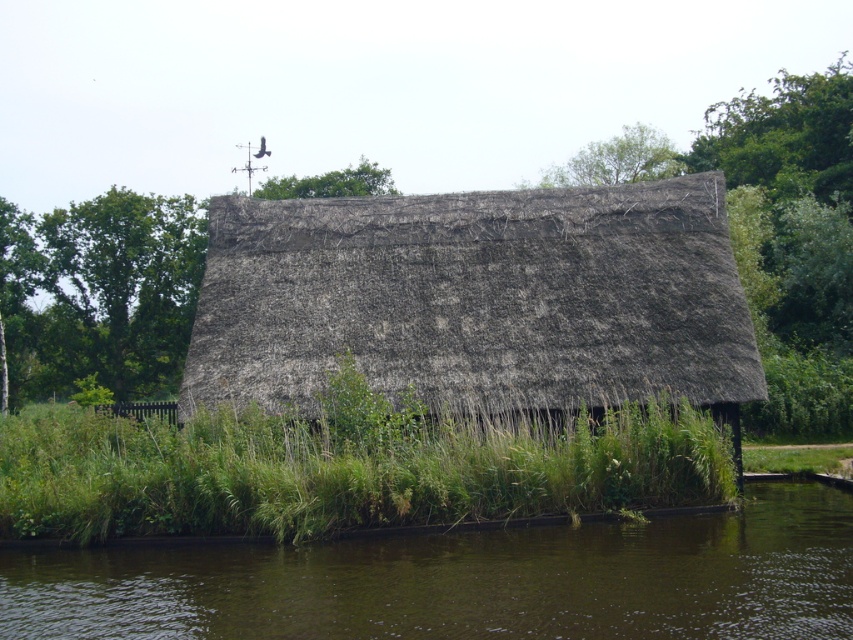
Question: Does brown murky water at lower center have a smaller size compared to green grass at lower center?

Choices:
 (A) yes
 (B) no

Answer: (A)

Question: Which point is farther to the camera?

Choices:
 (A) green grass at lower center
 (B) brown thatch roof at center

Answer: (B)

Question: In this image, where is brown thatch roof at center located relative to brown murky water at lower center?

Choices:
 (A) below
 (B) above

Answer: (B)

Question: Can you confirm if brown murky water at lower center is thinner than green grass at lower center?

Choices:
 (A) no
 (B) yes

Answer: (B)

Question: Which object is the closest to the green grass at lower center?

Choices:
 (A) brown murky water at lower center
 (B) brown thatch roof at center

Answer: (A)

Question: Estimate the real-world distances between objects in this image. Which object is farther from the brown thatch roof at center?

Choices:
 (A) brown murky water at lower center
 (B) green grass at lower center

Answer: (A)